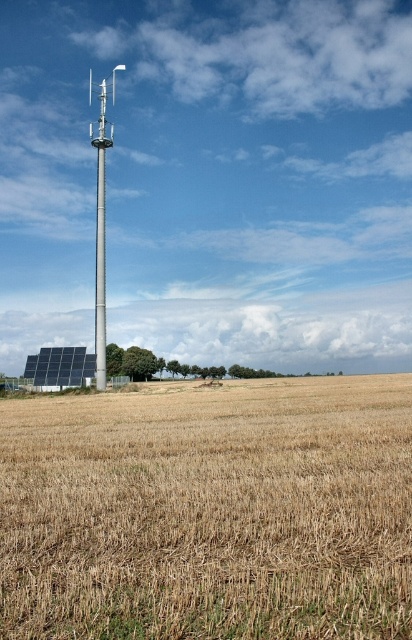
Question: Is black textured solar panel at lower left smaller than metallic pole at center?

Choices:
 (A) yes
 (B) no

Answer: (A)

Question: Which is nearer to the black textured solar panel at lower left?

Choices:
 (A) brown dry grass at lower center
 (B) silver metallic tower at center

Answer: (B)

Question: Which point is closer to the camera?

Choices:
 (A) (67, 362)
 (B) (98, 378)

Answer: (B)

Question: Which of the following is the closest to the observer?

Choices:
 (A) (100, 294)
 (B) (170, 460)

Answer: (B)

Question: Is black textured solar panel at lower left above metallic pole at center?

Choices:
 (A) yes
 (B) no

Answer: (B)

Question: Is silver metallic tower at center bigger than metallic pole at center?

Choices:
 (A) no
 (B) yes

Answer: (B)